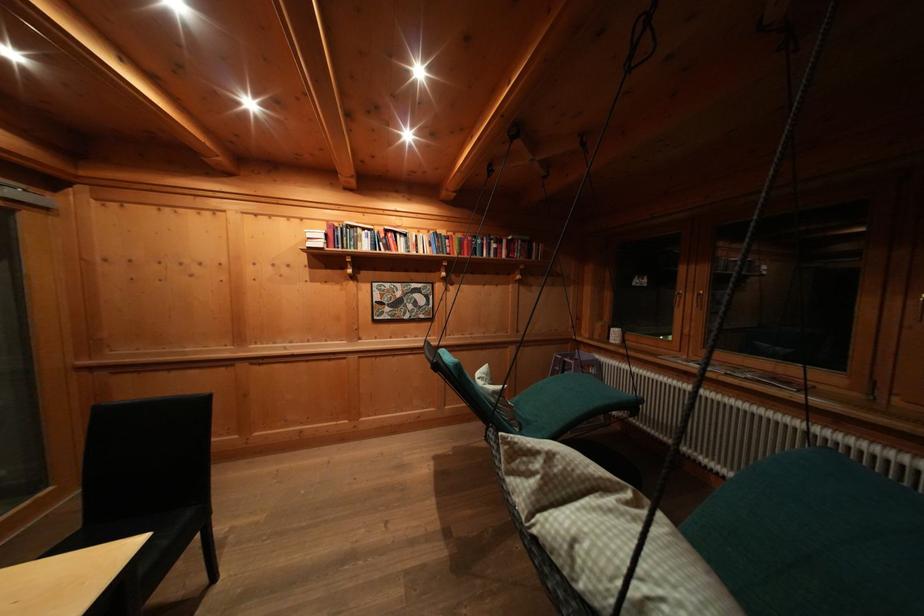
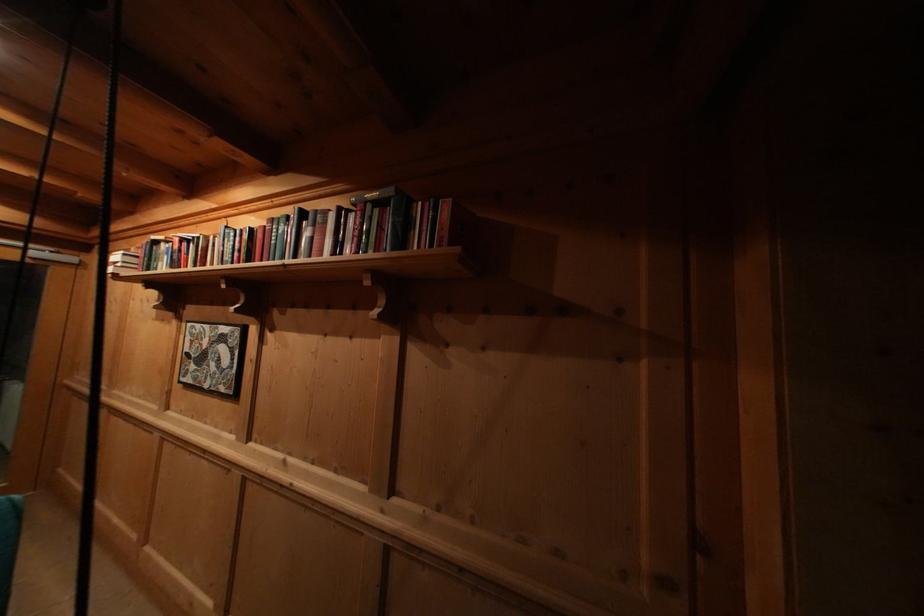
Where in the second image is the point corresponding to point 454,246 from the first image?

(244, 245)